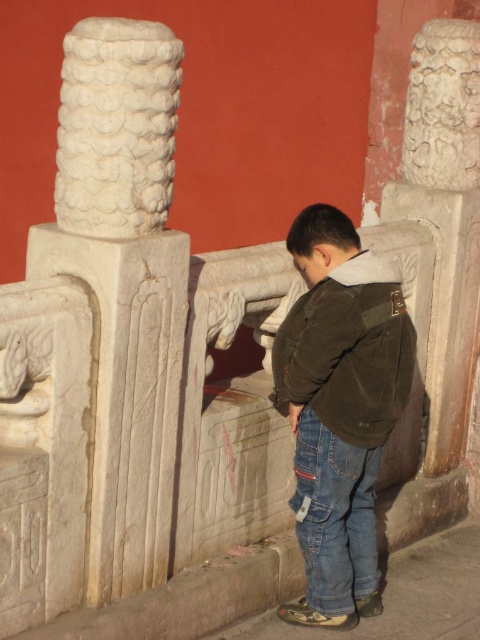
Does dark brown corduroy jacket at center appear on the right side of blue denim jeans at lower center?

Yes, dark brown corduroy jacket at center is to the right of blue denim jeans at lower center.

Does point (331, 582) come farther from viewer compared to point (365, 536)?

No, (331, 582) is closer to viewer.

Where is `dark brown corduroy jacket at center`? The height and width of the screenshot is (640, 480). dark brown corduroy jacket at center is located at coordinates (339, 408).

Who is more distant from viewer, (x=274, y=362) or (x=144, y=388)?

The point (x=274, y=362) is more distant.

Which is above, dark brown corduroy jacket at center or white stone column at center?

white stone column at center is above.

Is point (309, 572) behind point (132, 484)?

Yes, point (309, 572) is behind point (132, 484).

Where is `dark brown corduroy jacket at center`? dark brown corduroy jacket at center is located at coordinates (339, 408).

In the scene shown: Between white stone column at upper left and brown corduroy jacket at center, which one is positioned lower?

Positioned lower is brown corduroy jacket at center.

Is white stone column at upper left above brown corduroy jacket at center?

Correct, white stone column at upper left is located above brown corduroy jacket at center.

Which is in front, point (122, 68) or point (345, 380)?

Point (122, 68) is more forward.

The width and height of the screenshot is (480, 640). What are the coordinates of `white stone column at upper left` in the screenshot? It's located at click(117, 128).